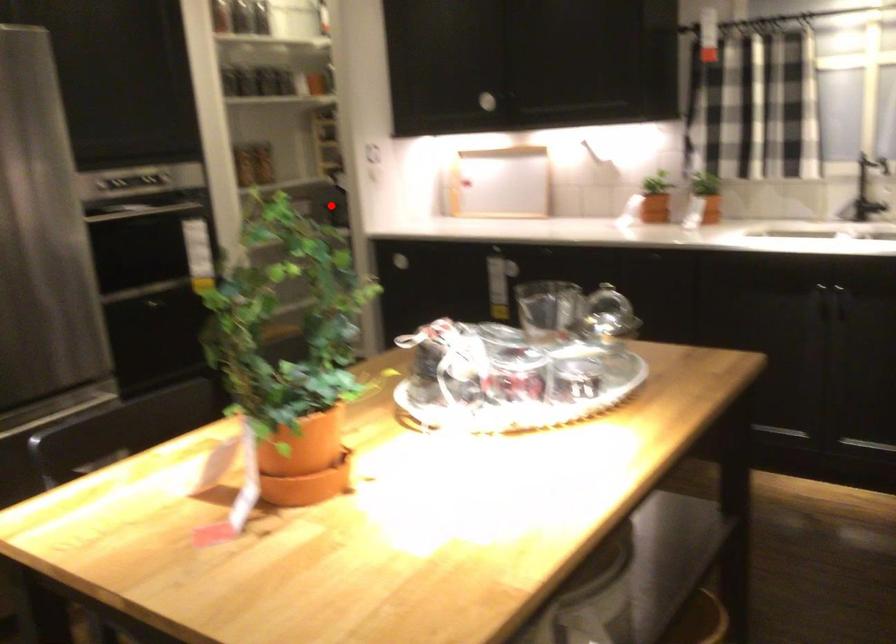
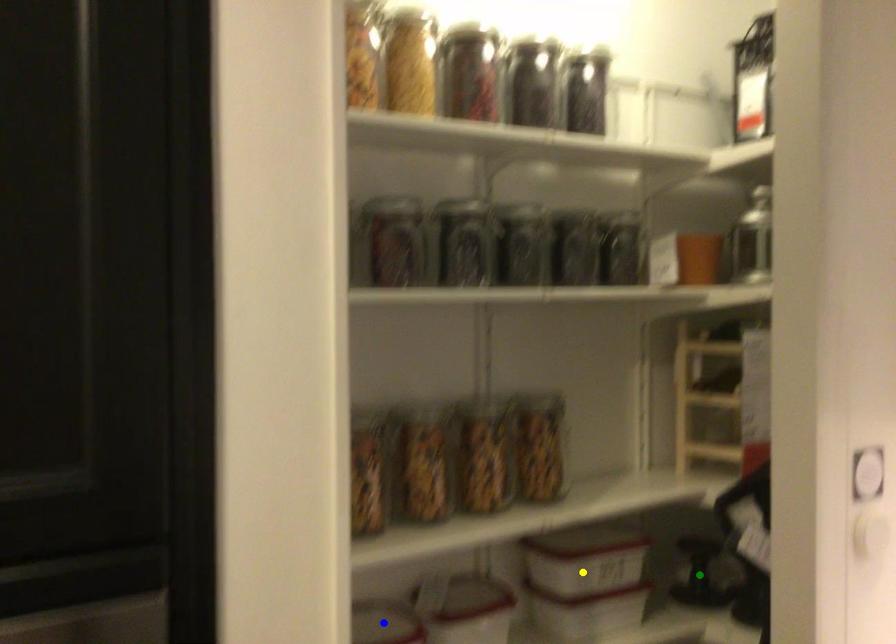
Question: I am providing you with two images of the same scene from different viewpoints. A red point is marked on the first image. You are given multiple points on the second image. Which mark in image 2 goes with the point in image 1?

Choices:
 (A) green point
 (B) blue point
 (C) yellow point

Answer: (A)